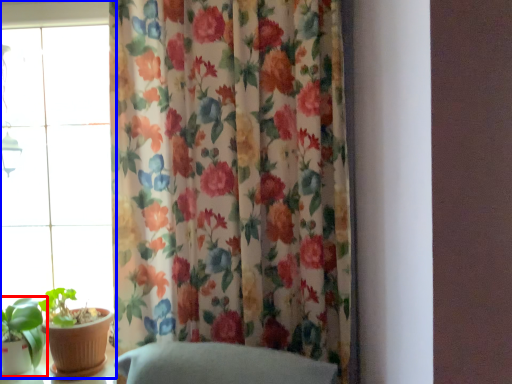
Question: Among these objects, which one is farthest to the camera, houseplant (highlighted by a red box) or window (highlighted by a blue box)?

Choices:
 (A) houseplant
 (B) window

Answer: (B)